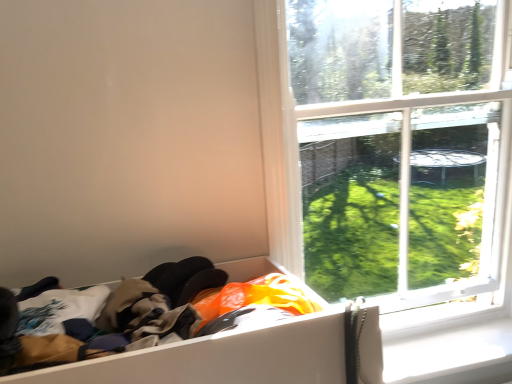
What is the approximate height of transparent glass window at upper right?

It is 1.28 meters.

Identify the location of white cardboard box at lower left. The height and width of the screenshot is (384, 512). (222, 359).

Would you say white plastic window sill at lower right is outside transparent glass window at upper right?

Yes, white plastic window sill at lower right is not within transparent glass window at upper right.

Can you tell me how much white plastic window sill at lower right and transparent glass window at upper right differ in facing direction?

They differ by 0.114 degrees in their facing directions.

Is white plastic window sill at lower right in front of or behind transparent glass window at upper right in the image?

Visually, white plastic window sill at lower right is located behind transparent glass window at upper right.

Between white plastic window sill at lower right and transparent glass window at upper right, which one has larger size?

transparent glass window at upper right.

Considering the relative sizes of white cardboard box at lower left and white plastic window sill at lower right in the image provided, is white cardboard box at lower left bigger than white plastic window sill at lower right?

Yes, white cardboard box at lower left is bigger than white plastic window sill at lower right.

From the image's perspective, is white cardboard box at lower left above or below white plastic window sill at lower right?

white cardboard box at lower left is situated higher than white plastic window sill at lower right in the image.

Is white cardboard box at lower left touching white plastic window sill at lower right?

white cardboard box at lower left is not next to white plastic window sill at lower right, and they're not touching.

Is white cardboard box at lower left located outside white plastic window sill at lower right?

Yes.

Is transparent glass window at upper right oriented towards white plastic window sill at lower right?

Yes.

Which point is more forward, (493, 113) or (440, 353)?

The point (493, 113) is closer to the camera.

Where is `window sill directly beneath the transparent glass window at upper right (from a real-world perspective)`? The image size is (512, 384). window sill directly beneath the transparent glass window at upper right (from a real-world perspective) is located at coordinates (453, 356).

Which is farther from the camera, (335, 370) or (367, 203)?

The point (367, 203) is farther.

Is white cardboard box at lower left at the left side of transparent glass window at upper right?

Yes, white cardboard box at lower left is to the left of transparent glass window at upper right.

Locate an element on the screen. The image size is (512, 384). window located behind the white cardboard box at lower left is located at coordinates (386, 146).

Identify the location of window above the white cardboard box at lower left (from a real-world perspective). The image size is (512, 384). (386, 146).

Is transparent glass window at upper right turned away from white cardboard box at lower left?

No, transparent glass window at upper right is not facing away from white cardboard box at lower left.

Considering the sizes of objects transparent glass window at upper right and white cardboard box at lower left in the image provided, who is taller, transparent glass window at upper right or white cardboard box at lower left?

transparent glass window at upper right.

From a real-world perspective, is transparent glass window at upper right physically located above or below white cardboard box at lower left?

In terms of real-world spatial position, transparent glass window at upper right is above white cardboard box at lower left.

Between point (438, 337) and point (221, 265), which one is positioned behind?

The point (438, 337) is farther from the camera.

Is white plastic window sill at lower right oriented towards white cardboard box at lower left?

No, white plastic window sill at lower right is not aimed at white cardboard box at lower left.

Is white plastic window sill at lower right surrounding white cardboard box at lower left?

Definitely not — white cardboard box at lower left is not inside white plastic window sill at lower right.

How far apart are white plastic window sill at lower right and white cardboard box at lower left?

The distance of white plastic window sill at lower right from white cardboard box at lower left is 3.49 feet.

Locate an element on the screen. The width and height of the screenshot is (512, 384). window located above the white plastic window sill at lower right (from the image's perspective) is located at coordinates (386, 146).

At what (x,y) coordinates should I click in order to perform the action: click on storage box above the white plastic window sill at lower right (from a real-world perspective). Please return your answer as a coordinate pair (x, y). This screenshot has height=384, width=512. Looking at the image, I should click on (222, 359).

Looking at the image, which one is located closer to transparent glass window at upper right, white cardboard box at lower left or white plastic window sill at lower right?

white plastic window sill at lower right is positioned closer to the anchor transparent glass window at upper right.

From the image, which object appears to be nearer to white cardboard box at lower left, transparent glass window at upper right or white plastic window sill at lower right?

Based on the image, transparent glass window at upper right appears to be nearer to white cardboard box at lower left.

Considering their positions, is transparent glass window at upper right positioned closer to white plastic window sill at lower right than white cardboard box at lower left?

The object closer to white plastic window sill at lower right is transparent glass window at upper right.

Which object lies further to the anchor point white cardboard box at lower left, white plastic window sill at lower right or transparent glass window at upper right?

white plastic window sill at lower right.

Based on their spatial positions, is white plastic window sill at lower right or white cardboard box at lower left closer to transparent glass window at upper right?

Based on the image, white plastic window sill at lower right appears to be nearer to transparent glass window at upper right.

Which object lies further to the anchor point white plastic window sill at lower right, white cardboard box at lower left or transparent glass window at upper right?

Result: white cardboard box at lower left lies further to white plastic window sill at lower right than the other object.

In order to click on window between white cardboard box at lower left and white plastic window sill at lower right in the front-back direction in this screenshot , I will do 386,146.